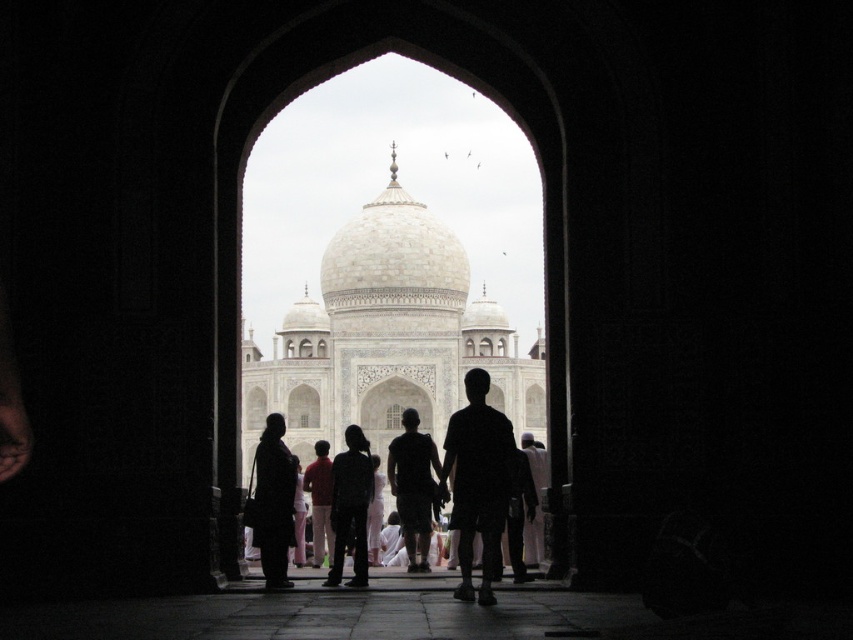
Question: Which is nearer to the dark fabric dress at center?

Choices:
 (A) dark fabric pants at center
 (B) silhouette clothing at center
 (C) black matte person at center

Answer: (B)

Question: Where is black matte person at center located in relation to dark fabric pants at center in the image?

Choices:
 (A) below
 (B) above

Answer: (B)

Question: Which of the following is the farthest from the observer?

Choices:
 (A) dark fabric pants at center
 (B) dark fabric dress at center
 (C) silhouette clothing at center

Answer: (A)

Question: Observing the image, what is the correct spatial positioning of dark fabric dress at center in reference to silhouette clothing at center?

Choices:
 (A) right
 (B) left

Answer: (B)

Question: Can you confirm if dark fabric pants at center is positioned to the right of silhouette clothing at center?

Choices:
 (A) yes
 (B) no

Answer: (A)

Question: Among these points, which one is farthest from the camera?

Choices:
 (A) (311, 486)
 (B) (340, 579)
 (C) (456, 413)

Answer: (A)